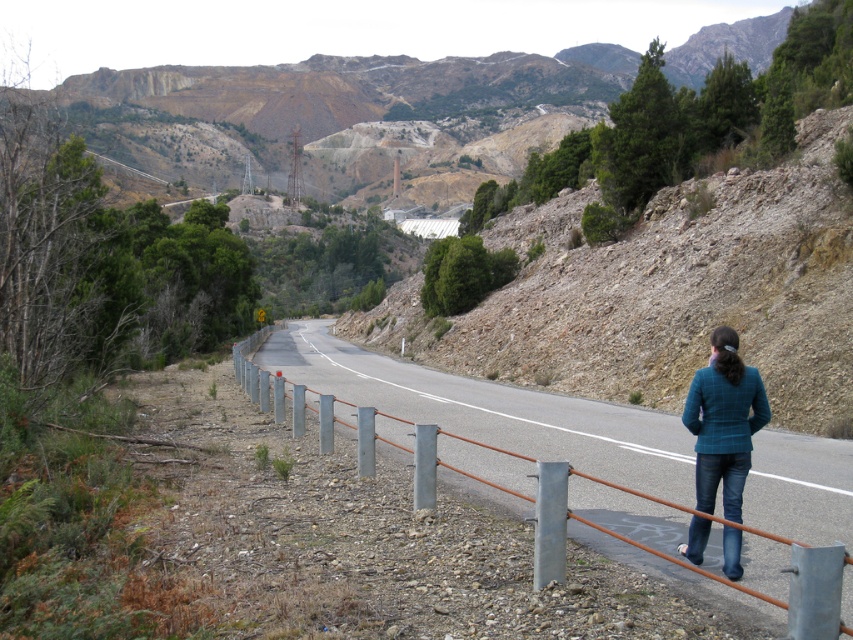
Question: Does metal/smooth fence at center appear on the right side of teal plaid jacket at lower right?

Choices:
 (A) yes
 (B) no

Answer: (B)

Question: Is metal/smooth fence at center to the left of teal plaid jacket at lower right from the viewer's perspective?

Choices:
 (A) yes
 (B) no

Answer: (A)

Question: Is metal/smooth fence at center further to the viewer compared to teal plaid jacket at lower right?

Choices:
 (A) no
 (B) yes

Answer: (A)